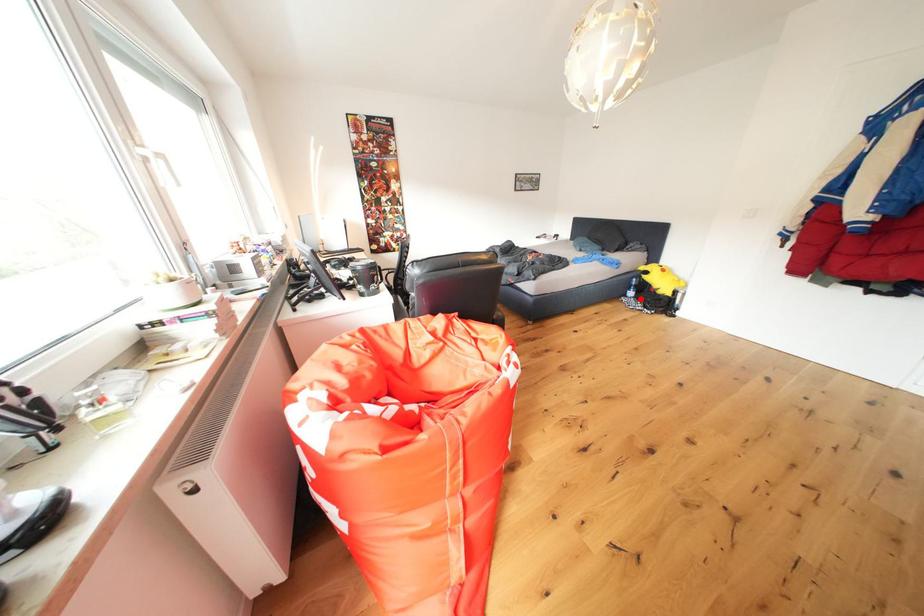
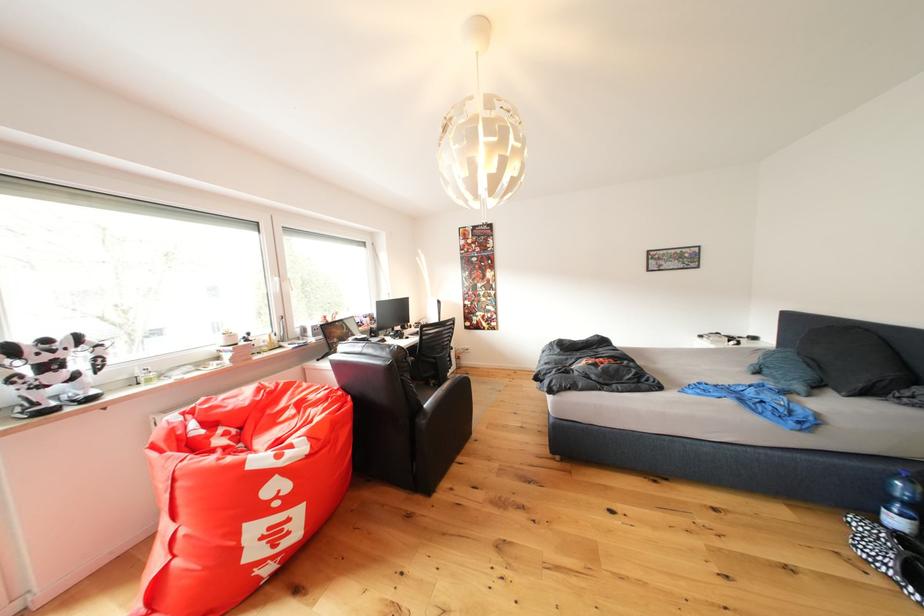
Locate, in the second image, the point that corresponds to the highlighted location in the first image.

(906, 527)